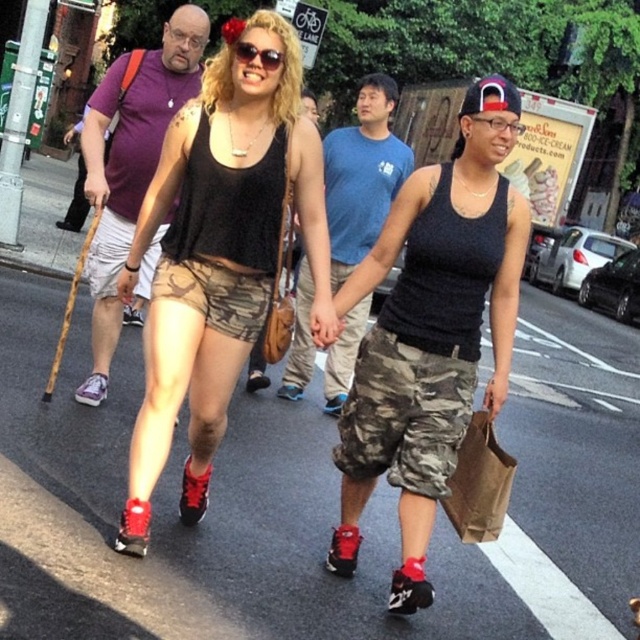
Who is taller, black matte tank top at center or purple cotton t-shirt at upper left?

Standing taller between the two is purple cotton t-shirt at upper left.

Measure the distance between black matte tank top at center and purple cotton t-shirt at upper left.

black matte tank top at center is 1.92 meters away from purple cotton t-shirt at upper left.

Is point (406, 298) positioned after point (141, 109)?

No, (406, 298) is closer to viewer.

The height and width of the screenshot is (640, 640). Find the location of `black matte tank top at center`. black matte tank top at center is located at coordinates (432, 333).

Between black matte tank top at center and blue cotton t-shirt at center, which one is positioned lower?

blue cotton t-shirt at center

Is point (344, 305) behind point (307, 362)?

No.

The height and width of the screenshot is (640, 640). Identify the location of black matte tank top at center. (432, 333).

Who is more distant from viewer, (192, 308) or (369, 76)?

The point (369, 76) is behind.

Can you confirm if camo shorts at center is smaller than blue cotton t-shirt at center?

Incorrect, camo shorts at center is not smaller in size than blue cotton t-shirt at center.

Who is more distant from viewer, (237, 58) or (374, 129)?

Positioned behind is point (374, 129).

The width and height of the screenshot is (640, 640). In order to click on camo shorts at center in this screenshot , I will do `click(220, 252)`.